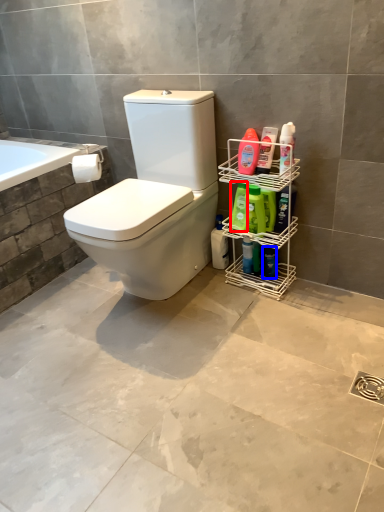
Question: Which object is further to the camera taking this photo, cleaning product (highlighted by a red box) or toiletry (highlighted by a blue box)?

Choices:
 (A) cleaning product
 (B) toiletry

Answer: (B)